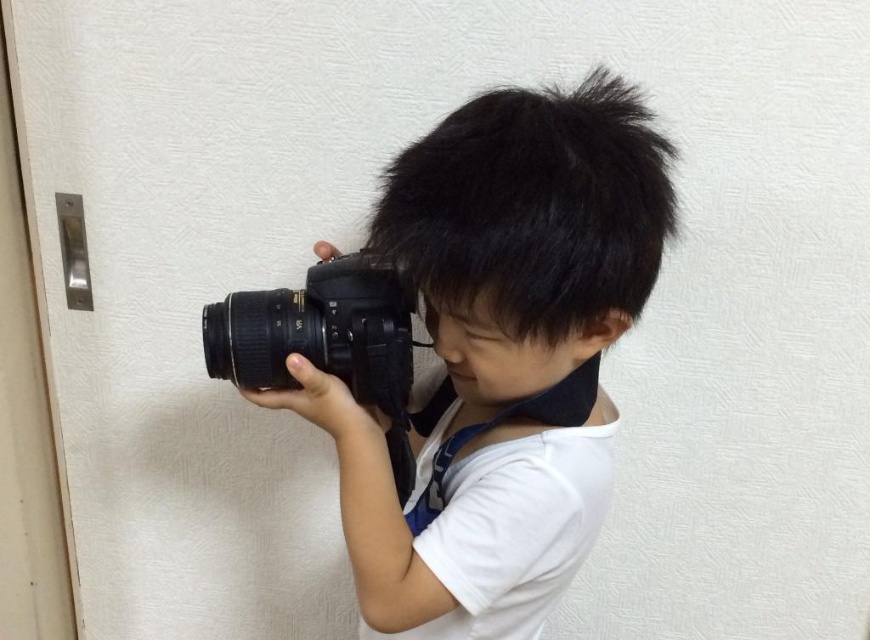
Who is taller, matte black camera at center or black rubberized camera at center?

Standing taller between the two is matte black camera at center.

Find the location of a particular element. This screenshot has height=640, width=870. matte black camera at center is located at coordinates (500, 356).

At what (x,y) coordinates should I click in order to perform the action: click on matte black camera at center. Please return your answer as a coordinate pair (x, y). Looking at the image, I should click on (500, 356).

Where is `matte black camera at center`? matte black camera at center is located at coordinates (500, 356).